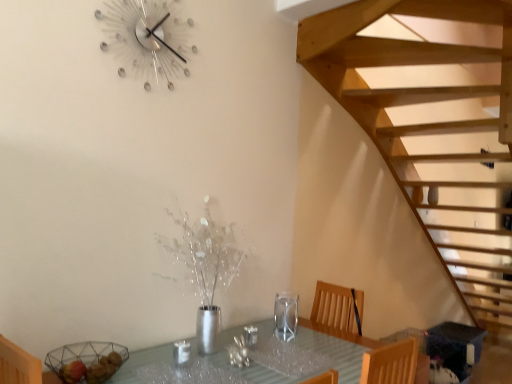
Image resolution: width=512 pixels, height=384 pixels. What are the coordinates of `free point above clear glass table at center (from a real-world perspective)` in the screenshot? It's located at (259, 358).